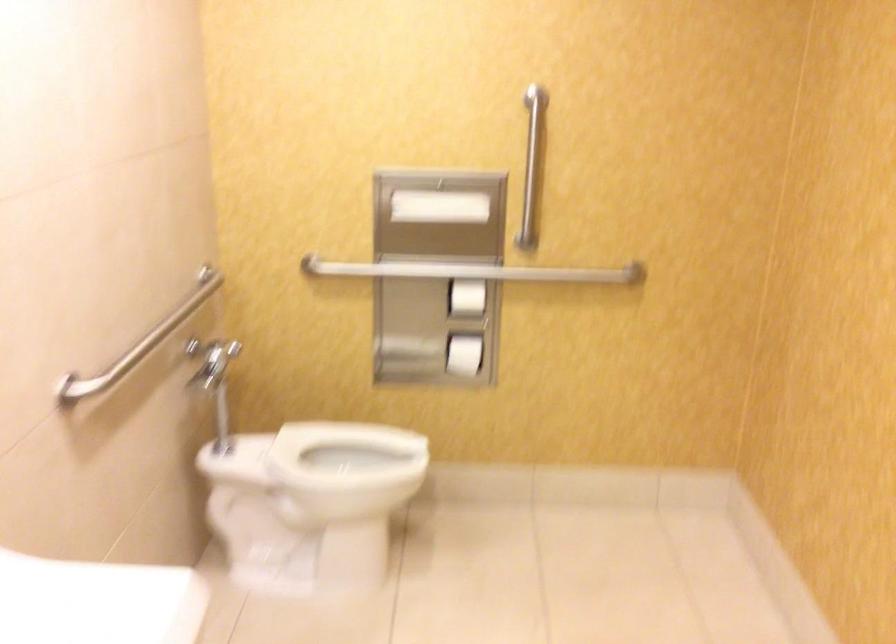
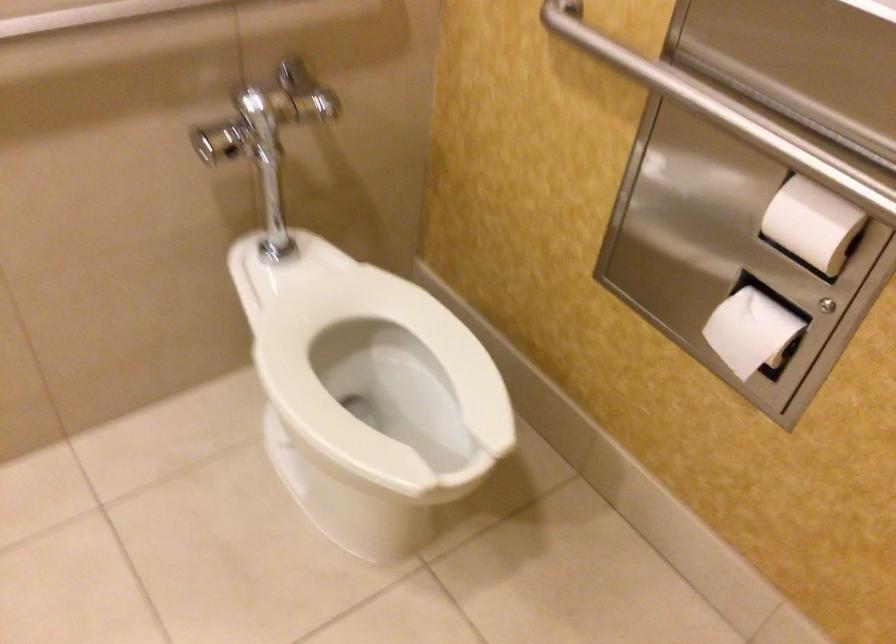
In the second image, find the point that corresponds to (x=315, y=488) in the first image.

(380, 381)